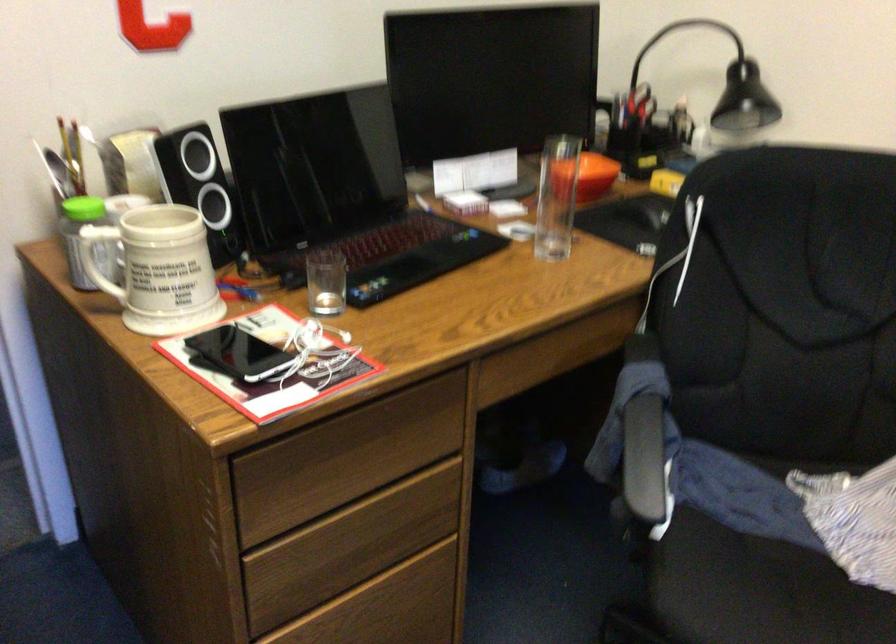
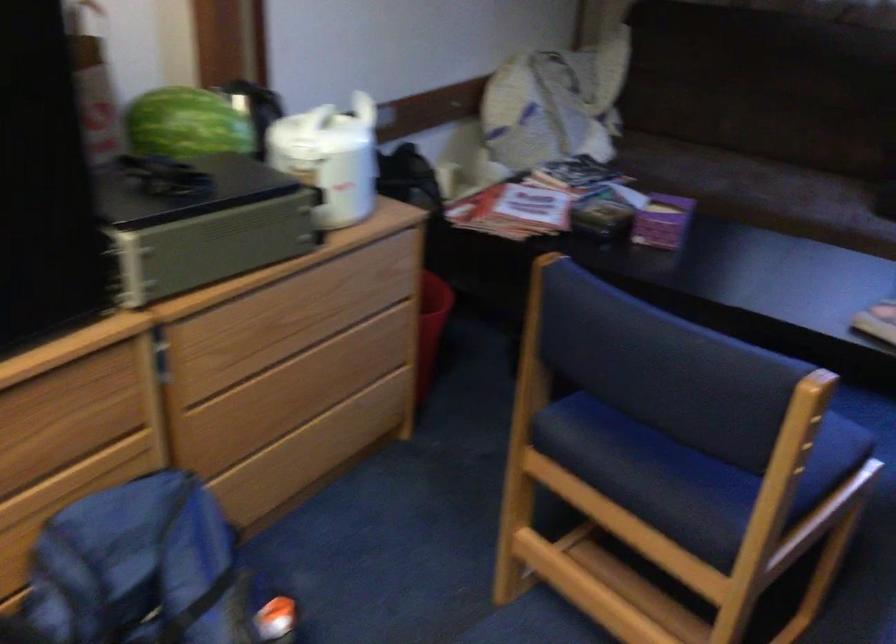
Looking at this image, the first image is from the beginning of the video and the second image is from the end. How did the camera likely rotate when shooting the video?

The camera's rotation is toward right-down.